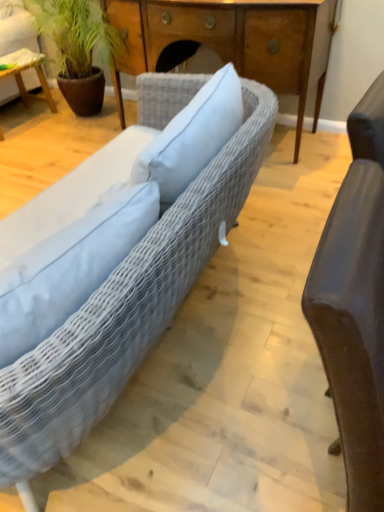
Question: Considering the relative sizes of wooden table at left and matte brown leather chair at right in the image provided, is wooden table at left smaller than matte brown leather chair at right?

Choices:
 (A) yes
 (B) no

Answer: (B)

Question: Is wooden table at left closer to the viewer compared to matte brown leather chair at right?

Choices:
 (A) yes
 (B) no

Answer: (B)

Question: Would you say wooden table at left is outside matte brown leather chair at right?

Choices:
 (A) yes
 (B) no

Answer: (A)

Question: From the image's perspective, does wooden table at left appear higher than matte brown leather chair at right?

Choices:
 (A) yes
 (B) no

Answer: (A)

Question: Is wooden table at left facing towards matte brown leather chair at right?

Choices:
 (A) yes
 (B) no

Answer: (B)

Question: In the image, is wooden table at left positioned in front of or behind green leafy plant at upper left?

Choices:
 (A) front
 (B) behind

Answer: (B)

Question: Is wooden table at left situated inside green leafy plant at upper left or outside?

Choices:
 (A) inside
 (B) outside

Answer: (A)

Question: From the image's perspective, is wooden table at left located above or below green leafy plant at upper left?

Choices:
 (A) above
 (B) below

Answer: (B)

Question: In terms of size, does wooden table at left appear bigger or smaller than green leafy plant at upper left?

Choices:
 (A) big
 (B) small

Answer: (B)

Question: From a real-world perspective, is green leafy plant at upper left physically located above or below wooden desk at center?

Choices:
 (A) below
 (B) above

Answer: (B)

Question: Is green leafy plant at upper left to the left or to the right of wooden desk at center in the image?

Choices:
 (A) left
 (B) right

Answer: (A)

Question: Would you say green leafy plant at upper left is inside or outside wooden desk at center?

Choices:
 (A) outside
 (B) inside

Answer: (A)

Question: Looking at the image, does green leafy plant at upper left seem bigger or smaller compared to wooden desk at center?

Choices:
 (A) small
 (B) big

Answer: (B)

Question: From their relative heights in the image, would you say matte brown leather chair at right is taller or shorter than green leafy plant at upper left?

Choices:
 (A) short
 (B) tall

Answer: (B)

Question: Visually, is matte brown leather chair at right positioned to the left or to the right of green leafy plant at upper left?

Choices:
 (A) right
 (B) left

Answer: (A)